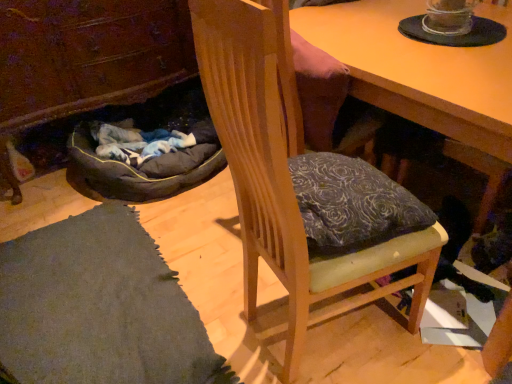
Identify the location of free spot below wooden chair at center (from a real-world perspective). (337, 337).